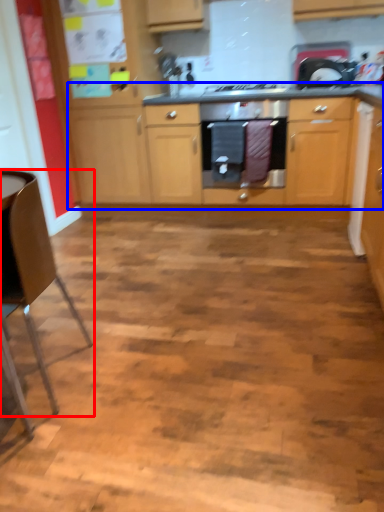
Question: Which point is closer to the camera, chair (highlighted by a red box) or cabinetry (highlighted by a blue box)?

Choices:
 (A) chair
 (B) cabinetry

Answer: (A)